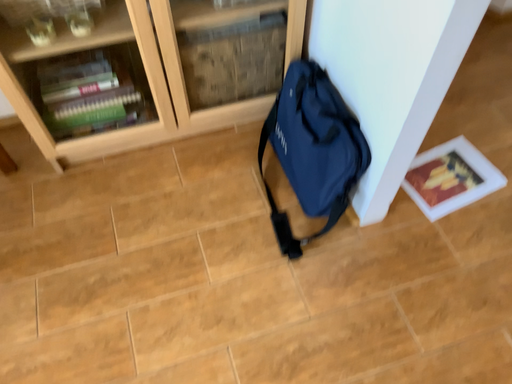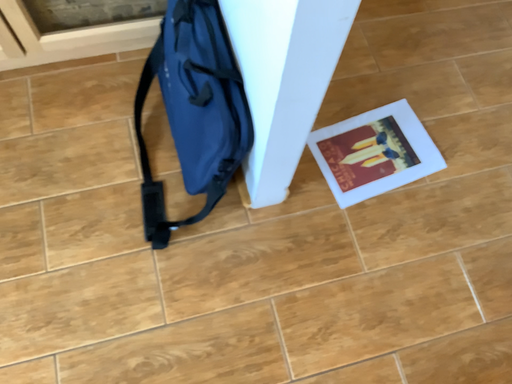
Question: How did the camera likely rotate when shooting the video?

Choices:
 (A) rotated upward
 (B) rotated downward

Answer: (B)